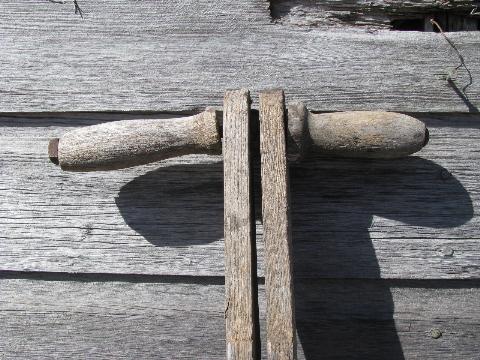
Identify the location of left handle. The width and height of the screenshot is (480, 360). (112, 146).